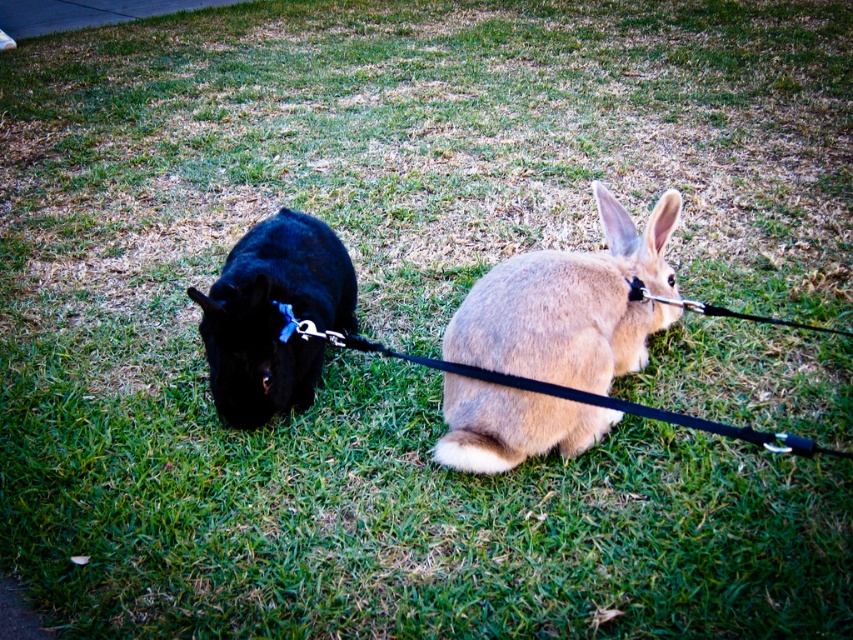
You are a dog owner trying to retrieve your dog from the scene. The dog is wearing a blue fabric neckband at center. There is also a fuzzy beige rabbit at center nearby. Which direction should you approach from to avoid startling the rabbit?

You should approach from behind the fuzzy beige rabbit at center because it is in front of the blue fabric neckband at center, meaning the dog is behind the rabbit. This way, you can reach the dog without alarming the rabbit.

You are a dog owner trying to decide if your dog can comfortably walk beside the fuzzy beige rabbit at center without the blue fabric neckband at center getting tangled. Based on their sizes, can they walk side by side?

The fuzzy beige rabbit at center might be wider than the blue fabric neckband at center, so there is a possibility of the neckband being wider than the rabbit. However, since the rabbit is wider, they can likely walk side by side without the blue fabric neckband at center causing tangling, provided there is enough space between them.

You are standing in the grassy area where the black dog and light brown rabbit are. You notice two points marked in the scene. The first point is at coordinates point (584, 276) and the second is at point (291, 288). If you want to reach the point that is closer to you first, which coordinate should you head towards?

You should head towards point (584, 276) because it is closer to the viewer than point (291, 288) according to the description.